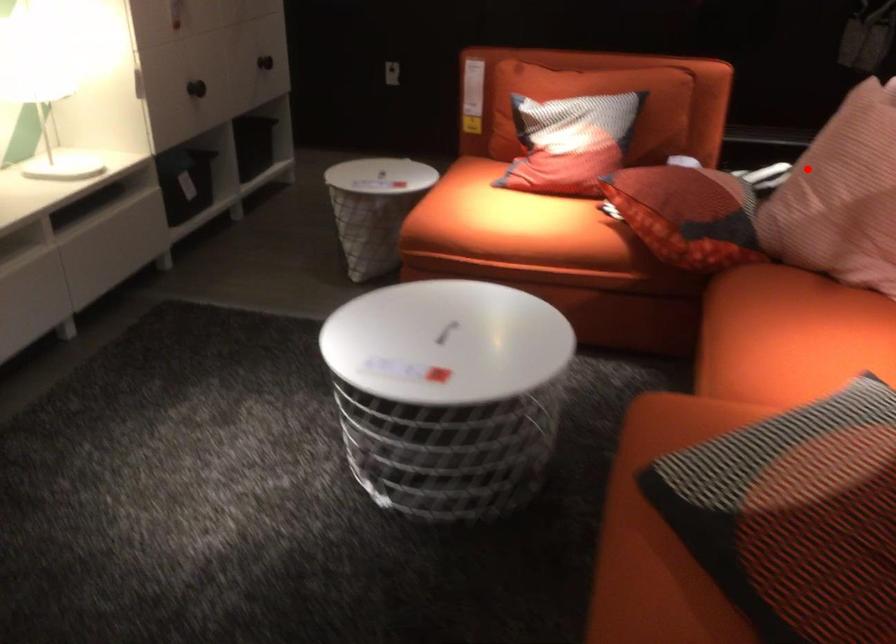
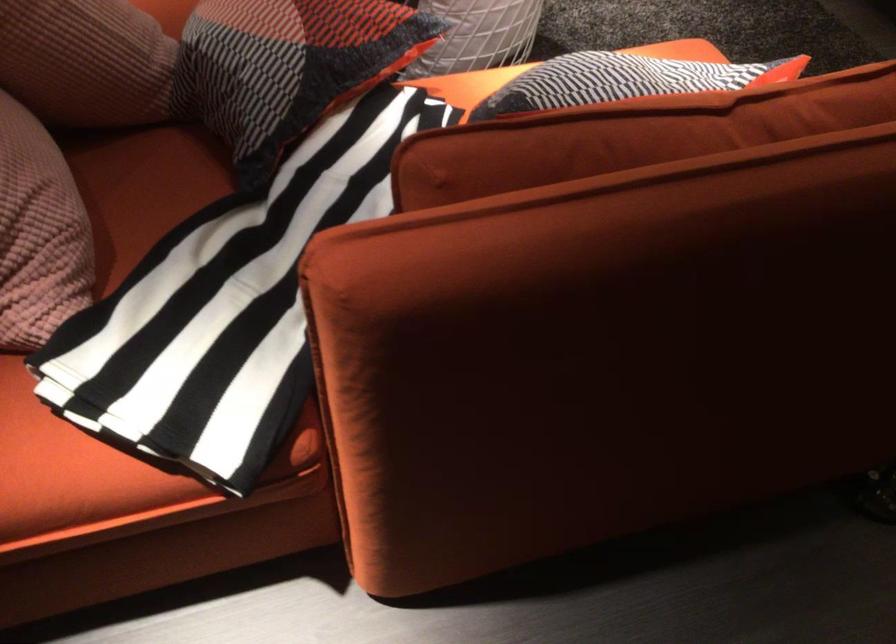
Question: A red point is marked in image1. In image2, is the corresponding 3D point closer to the camera or farther? Reply with the corresponding letter.

Choices:
 (A) The corresponding 3D point is closer.
 (B) The corresponding 3D point is farther.

Answer: (A)